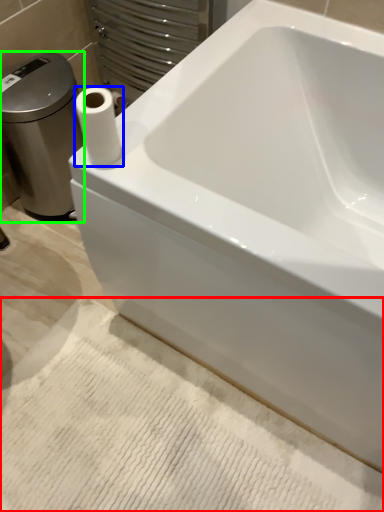
Question: Which object is the closest to the bath mat (highlighted by a red box)? Choose among these: paper towel (highlighted by a blue box) or porcelain (highlighted by a green box).

Choices:
 (A) paper towel
 (B) porcelain

Answer: (A)